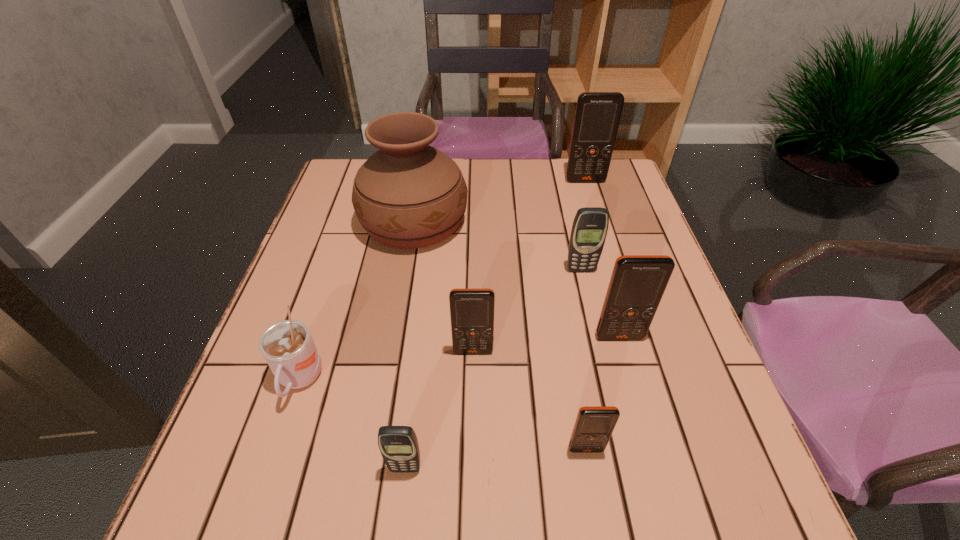
Locate an element on the screen. vacant space located 0.050m on the screen of the second nearest cellular telephone is located at coordinates (592, 484).

This screenshot has width=960, height=540. I want to click on free point located 0.060m on the screen of the left gray cellular telephone, so click(400, 512).

This screenshot has height=540, width=960. Identify the location of urn located at the far edge. (407, 195).

The height and width of the screenshot is (540, 960). What are the coordinates of `cellular telephone present at the far edge` in the screenshot? It's located at (597, 116).

Identify the location of urn present at the left edge. The width and height of the screenshot is (960, 540). (407, 195).

Where is `cup at the left edge`? This screenshot has width=960, height=540. cup at the left edge is located at coordinates (287, 346).

Find the location of `object situated at the far left corner`. object situated at the far left corner is located at coordinates (407, 195).

In order to click on object at the far right corner in this screenshot , I will do `click(597, 116)`.

In the image, there is a desktop. Identify the location of vacant space at the far edge. This screenshot has width=960, height=540. (515, 159).

Where is `free space at the near edge of the desktop`? Image resolution: width=960 pixels, height=540 pixels. free space at the near edge of the desktop is located at coordinates (426, 504).